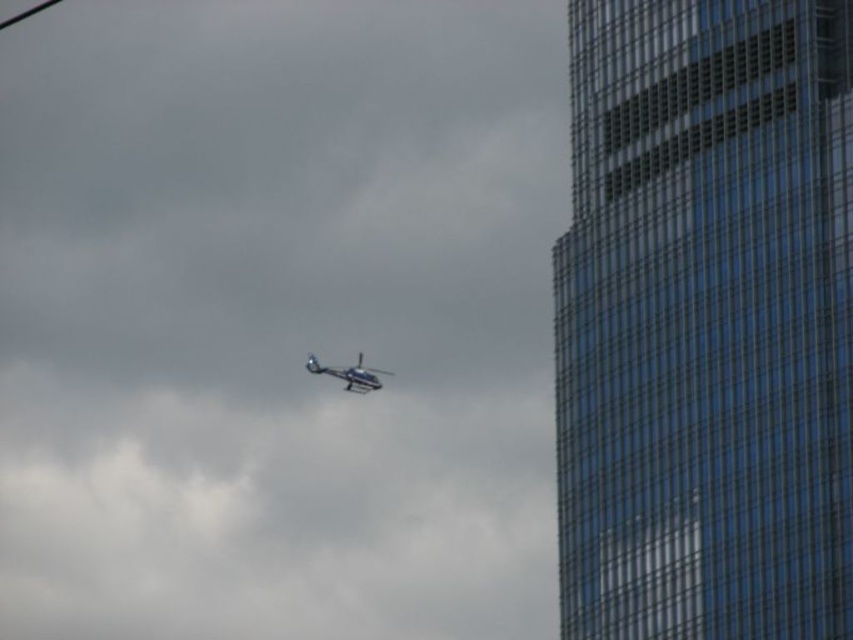
Consider the image. You are a pilot flying the metallic silver helicopter at center near a city. You need to navigate between the transparent glass tower at right and another building to your left. Based on their sizes, which object should you prioritize avoiding due to its height?

The transparent glass tower at right is much taller than the metallic silver helicopter at center, so you should prioritize avoiding the transparent glass tower at right due to its greater height.

Based on the photo, you are a pilot observing the scene. You notice the transparent glass tower at right and the metallic silver helicopter at center. Which object appears higher in the image?

The transparent glass tower at right is above the metallic silver helicopter at center, so the transparent glass tower at right appears higher in the image.

You are an observer standing on the ground looking at the transparent glass tower at right and the metallic silver helicopter at center. Which object appears larger in the image?

The transparent glass tower at right appears larger because it is closer to the viewer than the metallic silver helicopter at center.